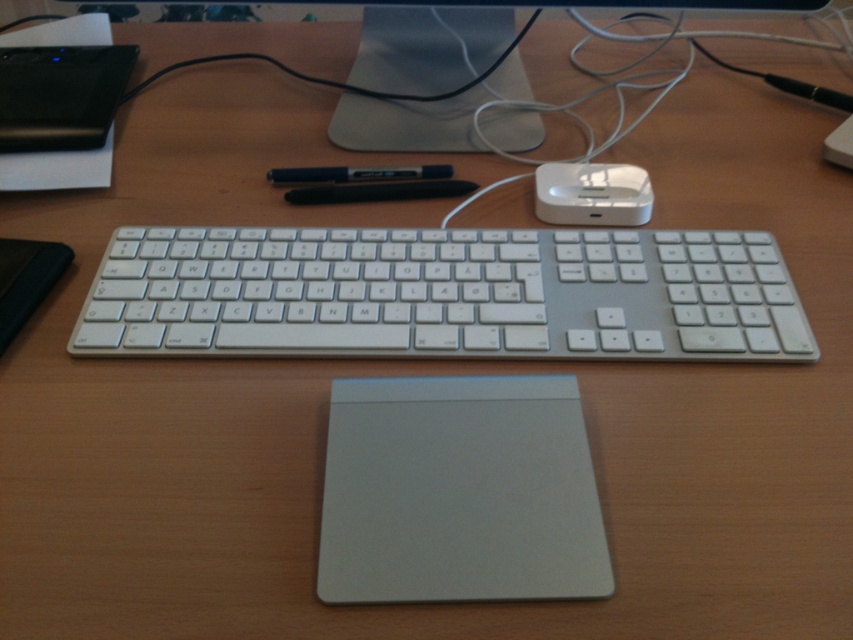
Does black rubber pen at center have a lesser height compared to black glossy pen at center?

Incorrect, black rubber pen at center's height does not fall short of black glossy pen at center's.

Is black rubber pen at center below black glossy pen at center?

Yes.

Does point (456, 188) come behind point (277, 172)?

No.

Where is `black rubber pen at center`? The height and width of the screenshot is (640, 853). black rubber pen at center is located at coordinates (379, 192).

Can you confirm if black plastic external hard drive at upper left is thinner than black rubber pen at center?

No, black plastic external hard drive at upper left is not thinner than black rubber pen at center.

Can you confirm if black plastic external hard drive at upper left is shorter than black rubber pen at center?

Incorrect, black plastic external hard drive at upper left's height does not fall short of black rubber pen at center's.

The height and width of the screenshot is (640, 853). What do you see at coordinates (61, 96) in the screenshot?
I see `black plastic external hard drive at upper left` at bounding box center [61, 96].

At what (x,y) coordinates should I click in order to perform the action: click on black plastic external hard drive at upper left. Please return your answer as a coordinate pair (x, y). This screenshot has height=640, width=853. Looking at the image, I should click on (61, 96).

Between silver aluminum keyboard at center and black glossy pen at center, which one appears on the right side from the viewer's perspective?

From the viewer's perspective, silver aluminum keyboard at center appears more on the right side.

Who is higher up, silver aluminum keyboard at center or black glossy pen at center?

black glossy pen at center is higher up.

Image resolution: width=853 pixels, height=640 pixels. Describe the element at coordinates (444, 294) in the screenshot. I see `silver aluminum keyboard at center` at that location.

At what (x,y) coordinates should I click in order to perform the action: click on silver aluminum keyboard at center. Please return your answer as a coordinate pair (x, y). Looking at the image, I should click on (444, 294).